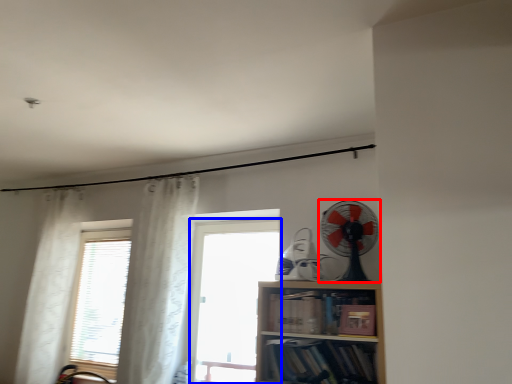
Question: Which of the following is the closest to the observer, mechanical fan (highlighted by a red box) or window (highlighted by a blue box)?

Choices:
 (A) mechanical fan
 (B) window

Answer: (A)